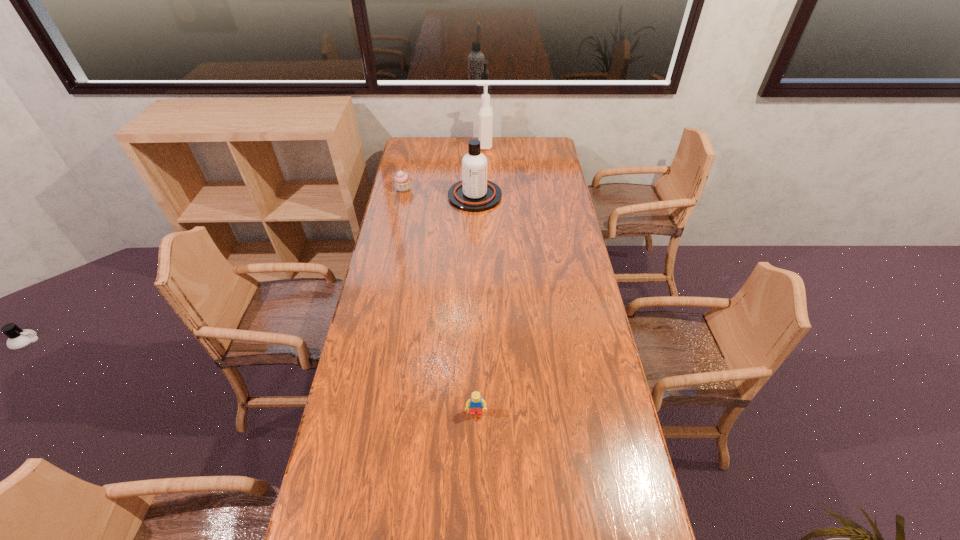
Where is `free spot between the Lego and the cupcake`? The image size is (960, 540). free spot between the Lego and the cupcake is located at coordinates (440, 301).

Locate an element on the screen. The image size is (960, 540). empty space that is in between the leftmost object and the nearest object is located at coordinates [440, 301].

This screenshot has width=960, height=540. I want to click on empty space between the tallest object and the Lego, so click(x=480, y=279).

The height and width of the screenshot is (540, 960). What are the coordinates of `vacant space that is in between the Lego and the cupcake` in the screenshot? It's located at (440, 301).

I want to click on vacant space in between the cupcake and the second tallest object, so click(x=439, y=192).

In order to click on free point between the Lego and the farthest object in this screenshot , I will do `click(480, 279)`.

Locate an element on the screen. object that is the third closest to the nearer cleansing agent is located at coordinates (475, 403).

Select which object appears as the third closest to the shorter cleansing agent. Please provide its 2D coordinates. Your answer should be formatted as a tuple, i.e. [(x, y)], where the tuple contains the x and y coordinates of a point satisfying the conditions above.

[(475, 403)]

Locate an element on the screen. The image size is (960, 540). free space in the image that satisfies the following two spatial constraints: 1. on the front side of the second tallest object; 2. on the right side of the leftmost object is located at coordinates (402, 196).

This screenshot has width=960, height=540. I want to click on free space that satisfies the following two spatial constraints: 1. on the front label of the taller cleansing agent; 2. on the front-facing side of the nearest object, so click(x=489, y=413).